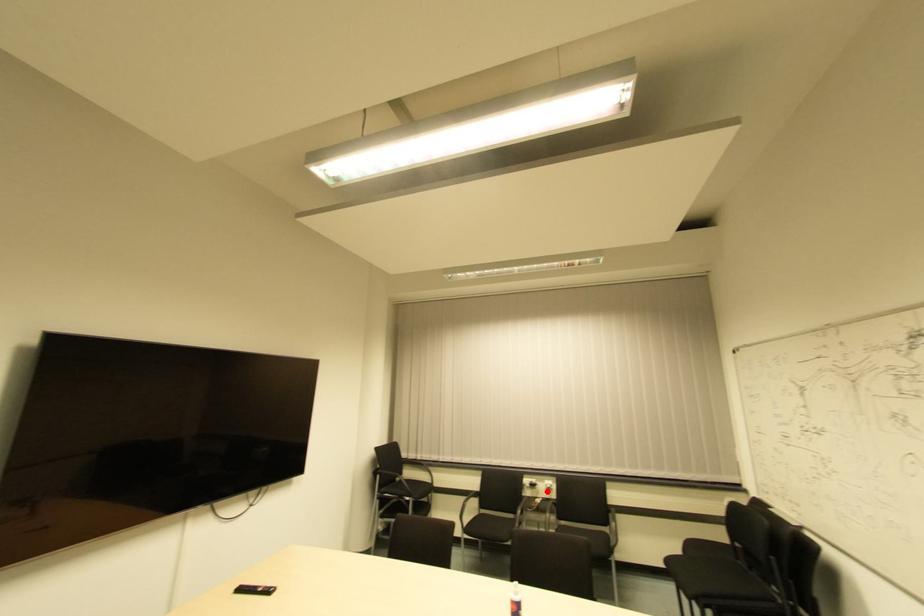
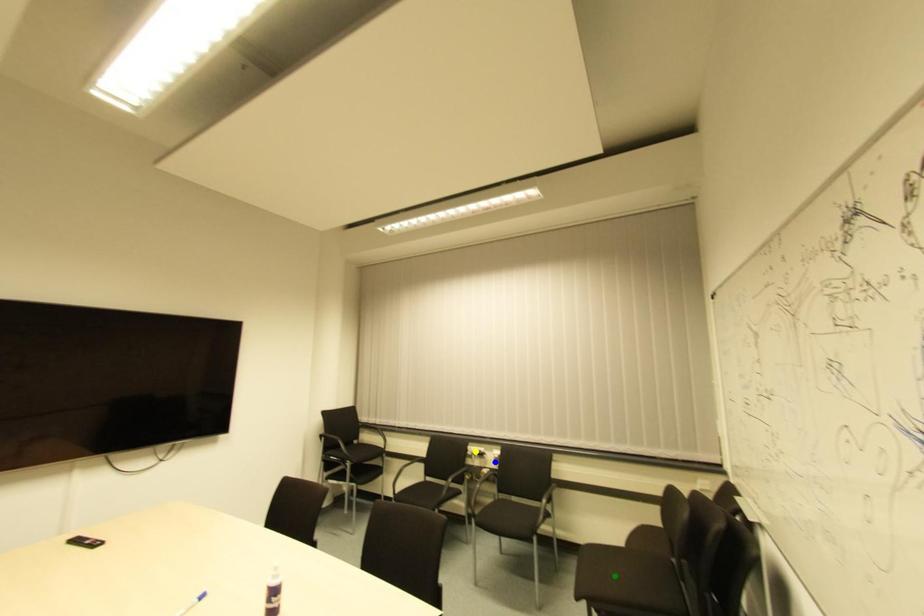
Question: I am providing you with two images of the same scene from different viewpoints. A red point is marked on the first image. You are given multiple points on the second image. Which point in image 2 is actually the same real-world point as the red point in image 1?

Choices:
 (A) blue point
 (B) green point
 (C) yellow point

Answer: (A)